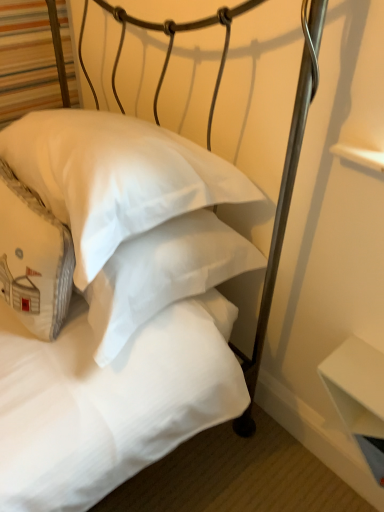
Question: From a real-world perspective, is white matte table at lower right over white cotton pillow at center, which is the second pillow from right to left?

Choices:
 (A) no
 (B) yes

Answer: (A)

Question: Is white matte table at lower right completely or partially outside of white cotton pillow at center, which is the second pillow from right to left?

Choices:
 (A) yes
 (B) no

Answer: (A)

Question: From the image's perspective, does white matte table at lower right appear higher than white cotton pillow at center, marked as the 1th pillow in a left-to-right arrangement?

Choices:
 (A) no
 (B) yes

Answer: (A)

Question: Can you confirm if white matte table at lower right is shorter than white cotton pillow at center, which is the second pillow from right to left?

Choices:
 (A) no
 (B) yes

Answer: (B)

Question: Is white matte table at lower right not close to white cotton pillow at center, marked as the 1th pillow in a left-to-right arrangement?

Choices:
 (A) no
 (B) yes

Answer: (A)

Question: From a real-world perspective, is white matte pillow at center, the 1th pillow from the right, above or below white matte table at lower right?

Choices:
 (A) below
 (B) above

Answer: (B)

Question: Considering the positions of white matte pillow at center, placed as the 2th pillow when sorted from left to right, and white matte table at lower right in the image, is white matte pillow at center, placed as the 2th pillow when sorted from left to right, wider or thinner than white matte table at lower right?

Choices:
 (A) thin
 (B) wide

Answer: (B)

Question: Does point (132, 228) appear closer or farther from the camera than point (345, 352)?

Choices:
 (A) farther
 (B) closer

Answer: (B)

Question: Would you say white matte pillow at center, the 1th pillow from the right, is to the left or to the right of white matte table at lower right in the picture?

Choices:
 (A) right
 (B) left

Answer: (B)

Question: From a real-world perspective, is white matte table at lower right positioned above or below white matte pillow at center, placed as the 2th pillow when sorted from left to right?

Choices:
 (A) above
 (B) below

Answer: (B)

Question: Would you say white matte table at lower right is to the left or to the right of white matte pillow at center, placed as the 2th pillow when sorted from left to right, in the picture?

Choices:
 (A) right
 (B) left

Answer: (A)

Question: In terms of size, does white matte table at lower right appear bigger or smaller than white matte pillow at center, the 1th pillow from the right?

Choices:
 (A) small
 (B) big

Answer: (A)

Question: Is white matte table at lower right taller or shorter than white matte pillow at center, the 1th pillow from the right?

Choices:
 (A) short
 (B) tall

Answer: (A)

Question: In the image, is white matte table at lower right positioned in front of or behind white cotton pillow at center, marked as the 1th pillow in a left-to-right arrangement?

Choices:
 (A) front
 (B) behind

Answer: (B)

Question: In terms of width, does white matte table at lower right look wider or thinner when compared to white cotton pillow at center, which is the second pillow from right to left?

Choices:
 (A) thin
 (B) wide

Answer: (A)